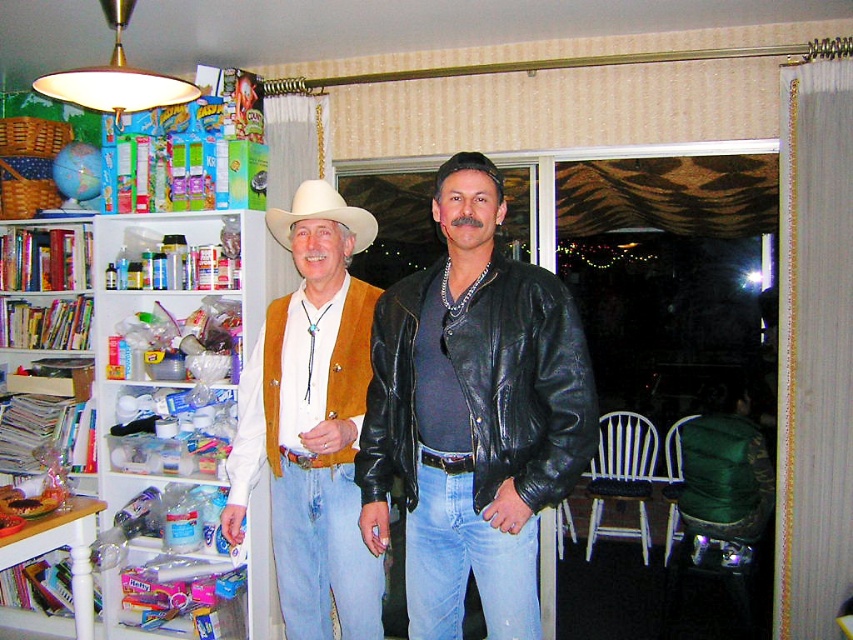
Who is lower down, matte brown vest at left or black leather jacket at center?

matte brown vest at left is below.

Is matte brown vest at left shorter than black leather jacket at center?

No, matte brown vest at left is not shorter than black leather jacket at center.

Where is `matte brown vest at left`? The image size is (853, 640). matte brown vest at left is located at coordinates coord(473,416).

At what (x,y) coordinates should I click in order to perform the action: click on matte brown vest at left. Please return your answer as a coordinate pair (x, y). The width and height of the screenshot is (853, 640). Looking at the image, I should click on (473, 416).

Does matte brown vest at center have a larger size compared to white plastic bookshelf at left?

No, matte brown vest at center is not bigger than white plastic bookshelf at left.

Between point (318, 198) and point (219, 224), which one is positioned behind?

Point (219, 224)

Does point (335, 336) lie in front of point (242, 349)?

Yes, point (335, 336) is in front of point (242, 349).

Image resolution: width=853 pixels, height=640 pixels. What are the coordinates of `matte brown vest at center` in the screenshot? It's located at (311, 420).

Which is more to the left, matte brown vest at center or black leather jacket at center?

From the viewer's perspective, matte brown vest at center appears more on the left side.

Measure the distance between matte brown vest at center and black leather jacket at center.

matte brown vest at center and black leather jacket at center are 33.86 centimeters apart from each other.

Is point (360, 580) closer to camera compared to point (407, 392)?

No, (360, 580) is further to viewer.

I want to click on matte brown vest at center, so click(x=311, y=420).